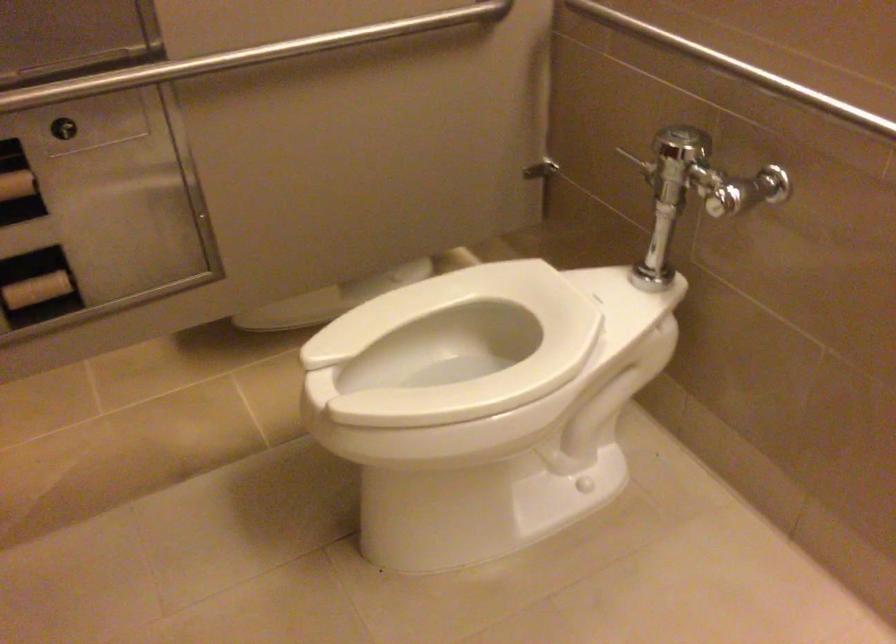
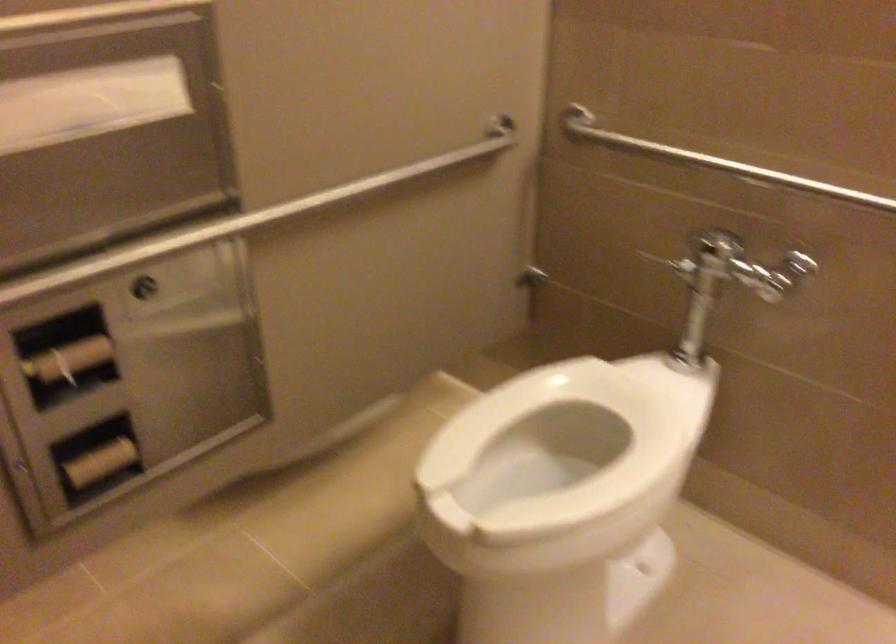
Locate, in the second image, the point that corresponds to [160,73] in the first image.

(246, 220)